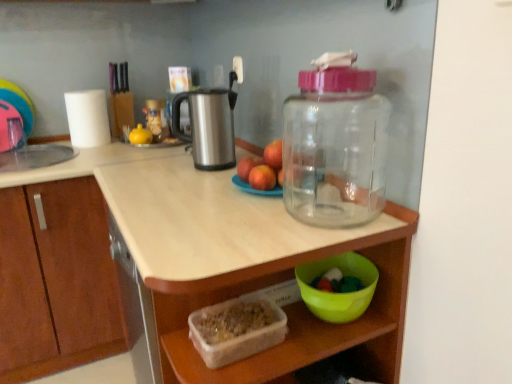
Locate an element on the screen. This screenshot has height=384, width=512. free space in front of yellow rubber duck at center is located at coordinates (131, 152).